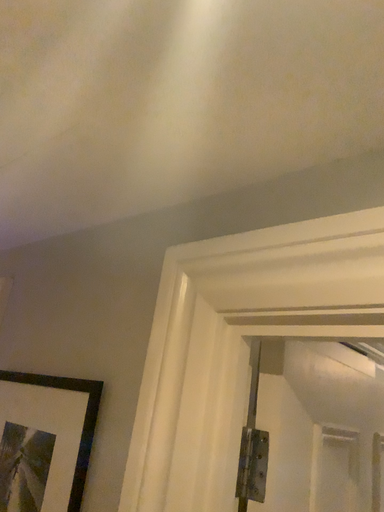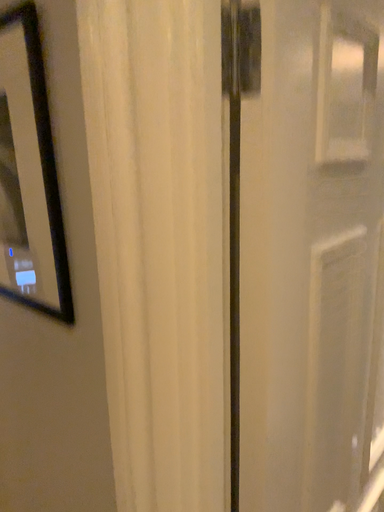
Question: How did the camera likely rotate when shooting the video?

Choices:
 (A) rotated upward
 (B) rotated downward

Answer: (B)